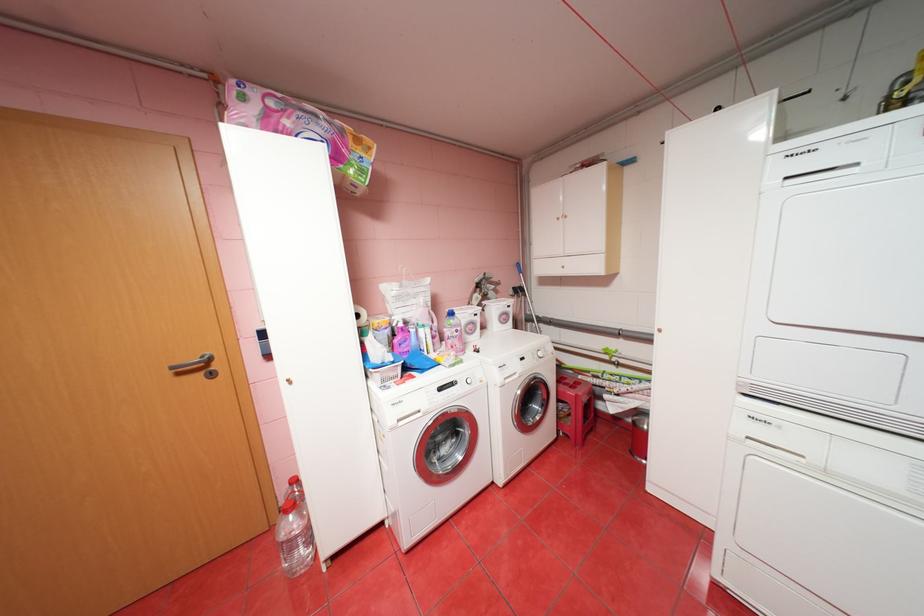
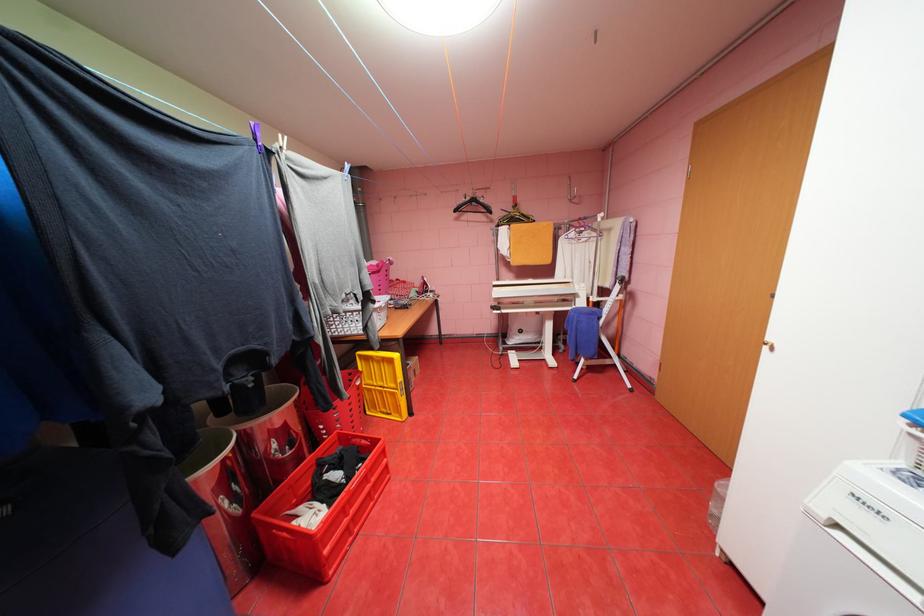
Question: I am providing you with two images of the same scene from different viewpoints. Which of the following objects are not visible in image2?

Choices:
 (A) white drying rack
 (B) white clothespin
 (C) purple clothespin
 (D) none of these

Answer: (D)